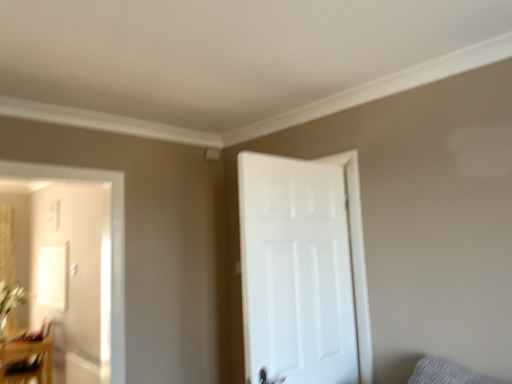
In order to face gray fabric pillow at lower right, should I rotate leftwards or rightwards?

You should look right and rotate roughly 25.965 degrees.

This screenshot has height=384, width=512. I want to click on gray fabric pillow at lower right, so click(x=447, y=373).

The height and width of the screenshot is (384, 512). In order to click on green leafy plant at left in this screenshot , I will do `click(11, 299)`.

Identify the location of white matte door at right. Image resolution: width=512 pixels, height=384 pixels. (357, 258).

Measure the distance between point [2,373] and camera.

Point [2,373] is 13.08 feet from camera.

This screenshot has height=384, width=512. In order to click on gray fabric pillow at lower right in this screenshot , I will do tap(447, 373).

Between point (13, 304) and point (367, 290), which one is positioned behind?

Positioned behind is point (13, 304).

This screenshot has height=384, width=512. I want to click on door above the green leafy plant at left (from the image's perspective), so click(x=357, y=258).

This screenshot has height=384, width=512. There is a wooden table at lower left. Identify the location of door above it (from a real-world perspective). (357, 258).

Considering the sizes of objects white matte door at right and wooden table at lower left in the image provided, who is taller, white matte door at right or wooden table at lower left?

Standing taller between the two is white matte door at right.

Which is in front, point (355, 242) or point (47, 372)?

The point (355, 242) is closer.

Between white matte door at right and wooden table at lower left, which one appears on the right side from the viewer's perspective?

white matte door at right is more to the right.

Is green leafy plant at left positioned in front of gray fabric pillow at lower right?

No, green leafy plant at left is behind gray fabric pillow at lower right.

Is green leafy plant at left wider than gray fabric pillow at lower right?

Yes, green leafy plant at left is wider than gray fabric pillow at lower right.

Which of these two, green leafy plant at left or gray fabric pillow at lower right, is smaller?

With smaller size is gray fabric pillow at lower right.

Based on the photo, how far apart are green leafy plant at left and gray fabric pillow at lower right?

The distance of green leafy plant at left from gray fabric pillow at lower right is 15.75 feet.

Can we say white matte door at right lies outside green leafy plant at left?

Indeed, white matte door at right is completely outside green leafy plant at left.

Considering the relative sizes of white matte door at right and green leafy plant at left in the image provided, is white matte door at right bigger than green leafy plant at left?

Indeed, white matte door at right has a larger size compared to green leafy plant at left.

You are a GUI agent. You are given a task and a screenshot of the screen. Output one action in this format:
    pyautogui.click(x=<x>, y=<y>)
    Task: Click on the plant below the white matte door at right (from a real-world perspective)
    This screenshot has width=512, height=384.
    Given the screenshot: What is the action you would take?
    pyautogui.click(x=11, y=299)

Is white matte door at right not close to green leafy plant at left?

That's right, there is a large distance between white matte door at right and green leafy plant at left.

Is wooden table at lower left in contact with white matte door at right?

No.

From the image's perspective, would you say wooden table at lower left is positioned over white matte door at right?

No, from the image's perspective, wooden table at lower left is not over white matte door at right.

Considering the sizes of objects wooden table at lower left and white matte door at right in the image provided, who is taller, wooden table at lower left or white matte door at right?

white matte door at right.

Between wooden table at lower left and white matte door at right, which one is positioned in front?

white matte door at right is more forward.

From a real-world perspective, who is located lower, wooden table at lower left or gray fabric pillow at lower right?

wooden table at lower left, from a real-world perspective.

Who is bigger, wooden table at lower left or gray fabric pillow at lower right?

Bigger between the two is wooden table at lower left.

Between point (27, 358) and point (414, 377), which one is positioned behind?

The point (27, 358) is farther.

Is wooden table at lower left further to the viewer compared to green leafy plant at left?

No, the depth of wooden table at lower left is less than that of green leafy plant at left.

Is wooden table at lower left thinner than green leafy plant at left?

Incorrect, the width of wooden table at lower left is not less than that of green leafy plant at left.

Considering the sizes of wooden table at lower left and green leafy plant at left in the image, is wooden table at lower left taller or shorter than green leafy plant at left?

Considering their sizes, wooden table at lower left has more height than green leafy plant at left.

Which object is positioned more to the left, wooden table at lower left or green leafy plant at left?

Positioned to the left is green leafy plant at left.

The image size is (512, 384). What are the coordinates of `plant below the white matte door at right (from a real-world perspective)` in the screenshot? It's located at (11, 299).

You are a GUI agent. You are given a task and a screenshot of the screen. Output one action in this format:
    pyautogui.click(x=<x>, y=<y>)
    Task: Click on the table located behind the white matte door at right
    
    Given the screenshot: What is the action you would take?
    pyautogui.click(x=26, y=361)

Considering their positions, is white matte door at right positioned further to wooden table at lower left than gray fabric pillow at lower right?

Among the two, gray fabric pillow at lower right is located further to wooden table at lower left.

From the picture: Looking at the image, which one is located closer to gray fabric pillow at lower right, green leafy plant at left or white matte door at right?

white matte door at right.

Based on their spatial positions, is green leafy plant at left or gray fabric pillow at lower right further from white matte door at right?

The object further to white matte door at right is green leafy plant at left.

Which object lies nearer to the anchor point green leafy plant at left, gray fabric pillow at lower right or white matte door at right?

Among the two, white matte door at right is located nearer to green leafy plant at left.

From the image, which object appears to be nearer to gray fabric pillow at lower right, wooden table at lower left or white matte door at right?

white matte door at right is positioned closer to the anchor gray fabric pillow at lower right.

When comparing their distances from green leafy plant at left, does gray fabric pillow at lower right or wooden table at lower left seem closer?

wooden table at lower left is closer to green leafy plant at left.

From the image, which object appears to be farther from gray fabric pillow at lower right, wooden table at lower left or green leafy plant at left?

Based on the image, green leafy plant at left appears to be further to gray fabric pillow at lower right.

Considering their positions, is green leafy plant at left positioned further to gray fabric pillow at lower right than wooden table at lower left?

green leafy plant at left is further to gray fabric pillow at lower right.

The width and height of the screenshot is (512, 384). In order to click on table between green leafy plant at left and gray fabric pillow at lower right in this screenshot , I will do `click(26, 361)`.

Where is `door between wooden table at lower left and gray fabric pillow at lower right`? This screenshot has height=384, width=512. door between wooden table at lower left and gray fabric pillow at lower right is located at coordinates (357, 258).

Find the location of a particular element. This screenshot has width=512, height=384. door situated between green leafy plant at left and gray fabric pillow at lower right from left to right is located at coordinates (357, 258).

Where is `table between green leafy plant at left and white matte door at right from left to right`? This screenshot has height=384, width=512. table between green leafy plant at left and white matte door at right from left to right is located at coordinates (26, 361).